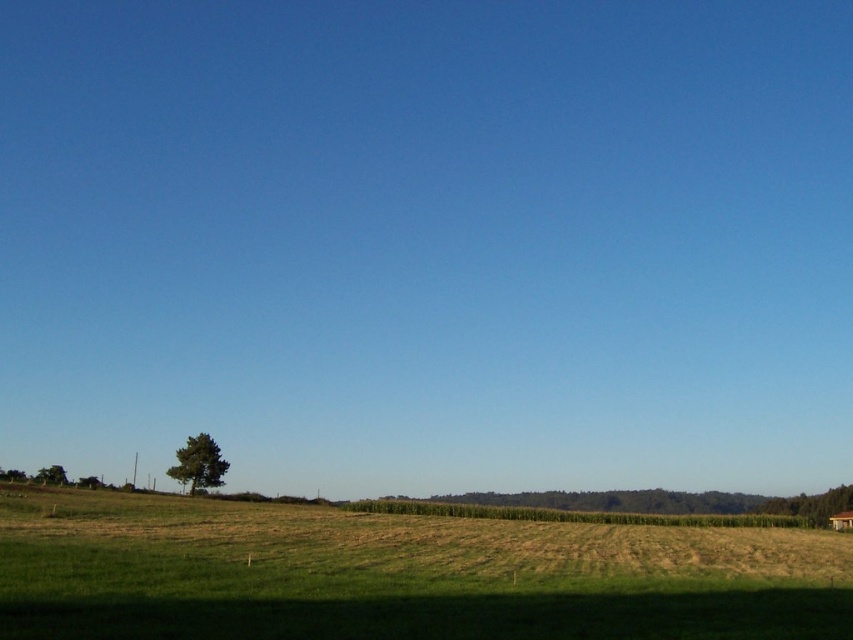
You are standing in the middle of the field and see both the green textured tree at lower left and the green leafy tree at lower left. Which tree is closer to your left side?

The green leafy tree at lower left is closer to your left side because the green textured tree at lower left is to the right of it.

You are standing in the middle of the grassy field in the rural landscape scene. You notice two points marked on the ground. One is labeled as point (393, 515) and the other as point (62, 472). Which point is closer to your current position?

Point (393, 515) is closer to the camera than point (62, 472), so it is closer to your current position.

You are standing at the point marked by coordinates point [399,576] in the rural landscape. What type of terrain are you currently standing on?

You are standing on the green grassy field at lower center, which is located at point [399,576].